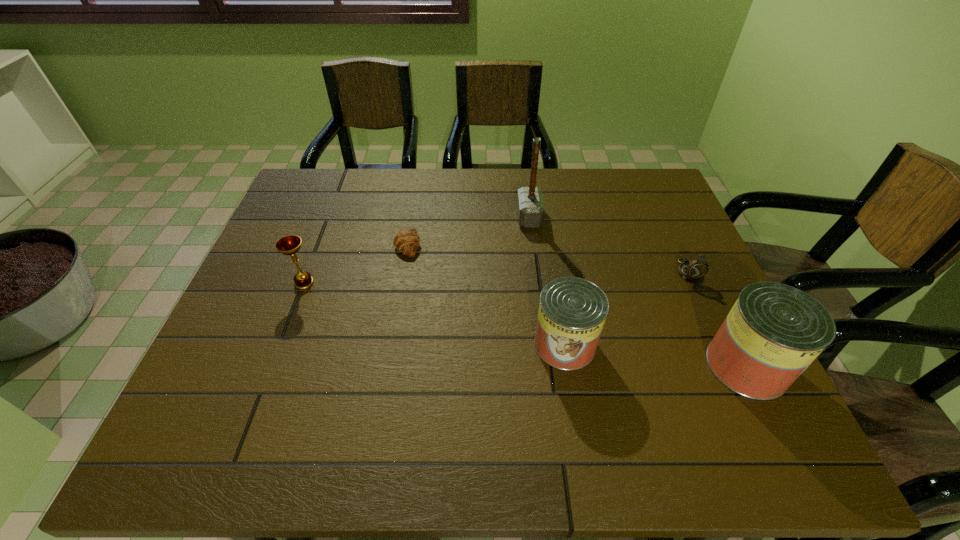
With all cans evenly spaced, where should an extra can be placed on the left to continue the pattern? Please point out a vacant space. Please provide its 2D coordinates. Your answer should be formatted as a tuple, i.e. [(x, y)], where the tuple contains the x and y coordinates of a point satisfying the conditions above.

[(396, 325)]